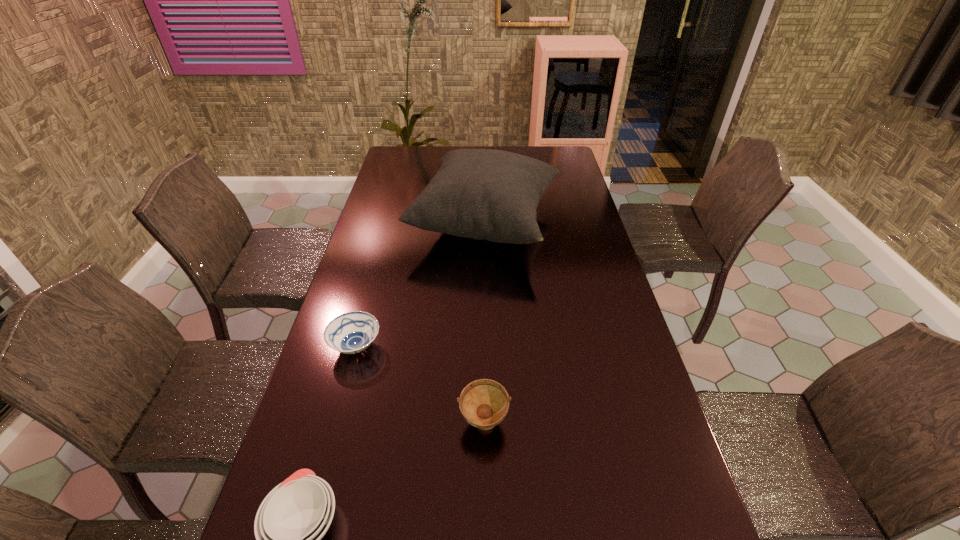
Where is `the tallest object`? This screenshot has width=960, height=540. the tallest object is located at coordinates (484, 194).

Where is `the farthest object`? This screenshot has height=540, width=960. the farthest object is located at coordinates (484, 194).

The image size is (960, 540). Find the location of `the third farthest object`. the third farthest object is located at coordinates (484, 403).

Where is `the rightmost soup bowl`? Image resolution: width=960 pixels, height=540 pixels. the rightmost soup bowl is located at coordinates (484, 403).

You are a GUI agent. You are given a task and a screenshot of the screen. Output one action in this format:
    pyautogui.click(x=<x>, y=<y>)
    Task: Click on the farthest soup bowl
    
    Given the screenshot: What is the action you would take?
    pyautogui.click(x=352, y=332)

Locate an element on the screen. The width and height of the screenshot is (960, 540). vacant space located 0.070m on the left of the farthest object is located at coordinates (391, 225).

Identify the location of vacant position located on the left of the third farthest object. (354, 423).

At what (x,y) coordinates should I click in order to perform the action: click on free space located on the right of the farthest soup bowl. Please return your answer as a coordinate pair (x, y). The height and width of the screenshot is (540, 960). Looking at the image, I should click on (478, 347).

Identify the location of object present at the left edge. Image resolution: width=960 pixels, height=540 pixels. (352, 332).

Identify the location of object present at the right edge. (484, 194).